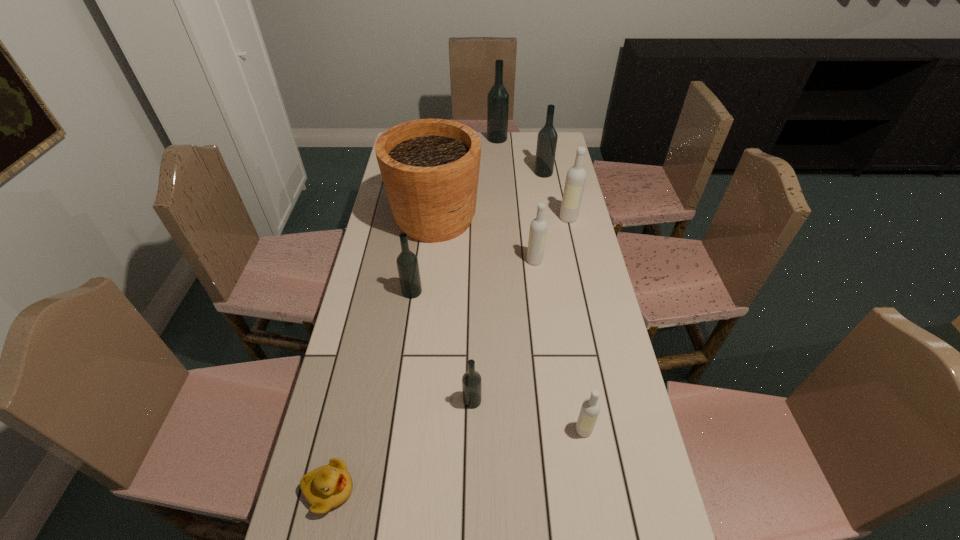
You are a GUI agent. You are given a task and a screenshot of the screen. Output one action in this format:
    pyautogui.click(x=<x>, y=<y>)
    Task: Click on the free space between the nearest black vodka and the farthest white vodka
    The height and width of the screenshot is (540, 960).
    Given the screenshot: What is the action you would take?
    pyautogui.click(x=520, y=309)

At what (x,y) coordinates should I click in order to perform the action: click on empty location between the nearest vodka and the tallest vodka. Please return your answer as a coordinate pair (x, y). This screenshot has width=960, height=540. Looking at the image, I should click on (540, 284).

Locate an element on the screen. The width and height of the screenshot is (960, 540). object that is the second closest to the biggest white vodka is located at coordinates (547, 138).

Find the location of a particular element. This screenshot has width=960, height=540. object identified as the fifth closest to the flowerpot is located at coordinates (498, 97).

Identify which vodka is the sixth closest to the leftmost black vodka. Please provide its 2D coordinates. Your answer should be formatted as a tuple, i.e. [(x, y)], where the tuple contains the x and y coordinates of a point satisfying the conditions above.

[(498, 97)]

At what (x,y) coordinates should I click in order to perform the action: click on vodka that is the closest to the fourth vodka from left to right. Please return your answer as a coordinate pair (x, y). The width and height of the screenshot is (960, 540). Looking at the image, I should click on (575, 181).

At what (x,y) coordinates should I click in order to perform the action: click on the third closest black vodka to the flowerpot. Please return your answer as a coordinate pair (x, y). This screenshot has height=540, width=960. Looking at the image, I should click on (498, 97).

I want to click on black vodka that is the second closest to the leftmost white vodka, so click(x=547, y=138).

Select which white vodka is the second closest to the smallest white vodka. Please provide its 2D coordinates. Your answer should be formatted as a tuple, i.e. [(x, y)], where the tuple contains the x and y coordinates of a point satisfying the conditions above.

[(575, 181)]

Where is `the closest white vodka relative to the nearest vodka`? the closest white vodka relative to the nearest vodka is located at coordinates (538, 228).